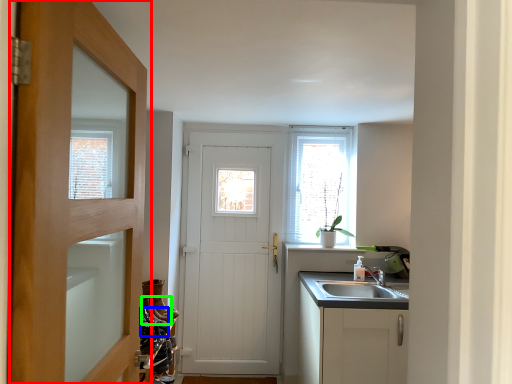
Question: Which object is positioned closest to door (highlighted by a red box)? Select from shoe (highlighted by a blue box) and shoe (highlighted by a green box).

Choices:
 (A) shoe
 (B) shoe

Answer: (A)